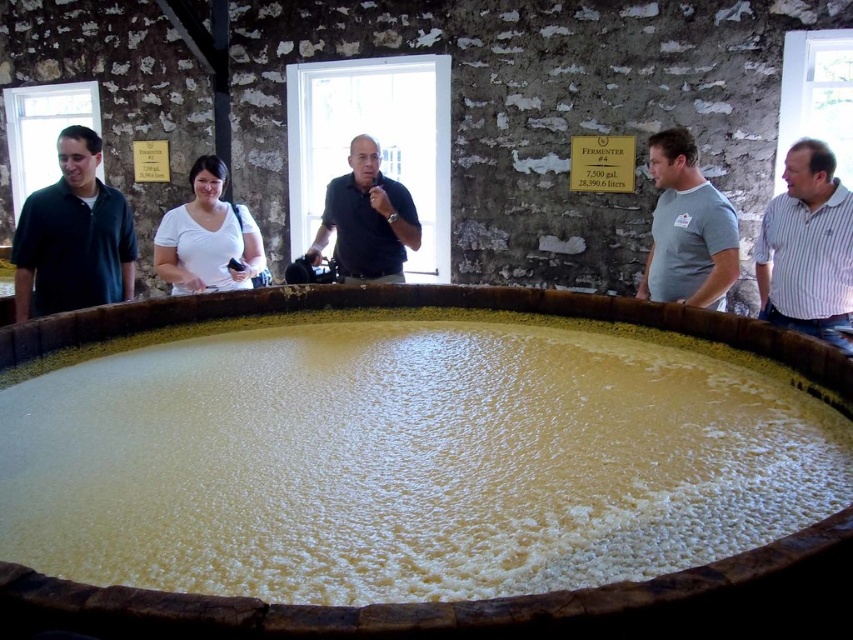
Question: Does yellowish creamy substance at center appear over gray cotton t-shirt at center?

Choices:
 (A) yes
 (B) no

Answer: (B)

Question: Observing the image, what is the correct spatial positioning of green matte shirt at left in reference to striped cotton shirt at right?

Choices:
 (A) below
 (B) above

Answer: (B)

Question: Which object is positioned farthest from the black matte shirt at center?

Choices:
 (A) green matte shirt at left
 (B) white matte shirt at center
 (C) gray cotton t-shirt at center

Answer: (C)

Question: Can you confirm if green matte shirt at left is positioned above striped cotton shirt at right?

Choices:
 (A) no
 (B) yes

Answer: (B)

Question: Which point is closer to the camera?

Choices:
 (A) (349, 260)
 (B) (824, 152)
 (C) (469, 573)
 (D) (714, 211)

Answer: (C)

Question: Which of the following is the closest to the observer?

Choices:
 (A) gray cotton t-shirt at center
 (B) white matte shirt at center
 (C) striped cotton shirt at right
 (D) green matte shirt at left

Answer: (A)